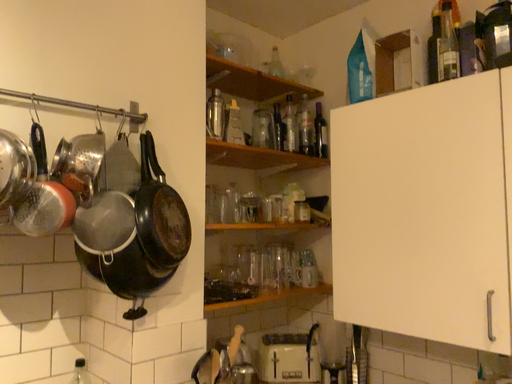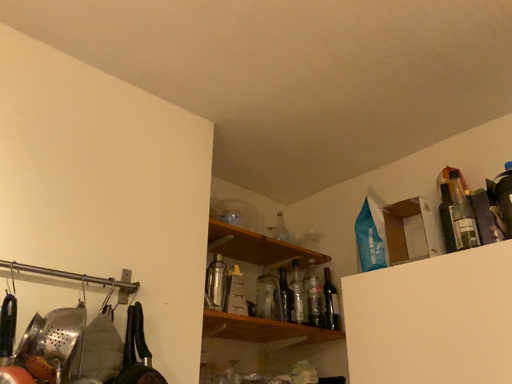
Question: Which way did the camera rotate in the video?

Choices:
 (A) rotated downward
 (B) rotated upward

Answer: (B)